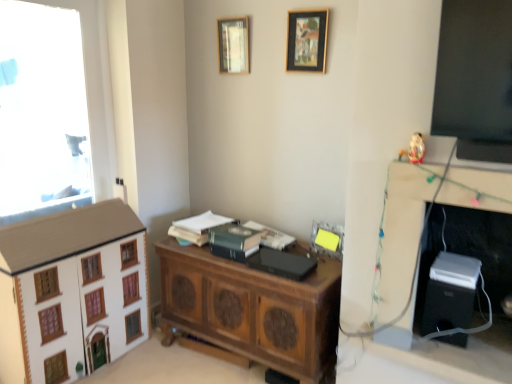
Question: Is wooden chest at center to the right of green matte book at center, which is the 2th book in left-to-right order, from the viewer's perspective?

Choices:
 (A) no
 (B) yes

Answer: (B)

Question: Does wooden chest at center have a larger size compared to green matte book at center, which is the 2th book in left-to-right order?

Choices:
 (A) no
 (B) yes

Answer: (B)

Question: Is wooden chest at center not within green matte book at center, which is counted as the third book, starting from the right?

Choices:
 (A) yes
 (B) no

Answer: (A)

Question: Does wooden chest at center appear on the left side of green matte book at center, which is counted as the third book, starting from the right?

Choices:
 (A) no
 (B) yes

Answer: (A)

Question: Is wooden chest at center positioned with its back to green matte book at center, which is counted as the third book, starting from the right?

Choices:
 (A) no
 (B) yes

Answer: (A)

Question: In terms of size, does white wood dresser at lower left appear bigger or smaller than wooden picture frame at upper center, the 2th picture frame when ordered from right to left?

Choices:
 (A) big
 (B) small

Answer: (A)

Question: From a real-world perspective, relative to wooden picture frame at upper center, placed as the 2th picture frame when sorted from top to bottom, is white wood dresser at lower left vertically above or below?

Choices:
 (A) above
 (B) below

Answer: (B)

Question: Which is correct: white wood dresser at lower left is inside wooden picture frame at upper center, placed as the 2th picture frame when sorted from top to bottom, or outside of it?

Choices:
 (A) inside
 (B) outside

Answer: (B)

Question: From their relative heights in the image, would you say white wood dresser at lower left is taller or shorter than wooden picture frame at upper center, placed as the 2th picture frame when sorted from top to bottom?

Choices:
 (A) tall
 (B) short

Answer: (A)

Question: From a real-world perspective, is black matte book at center, positioned as the fourth book in left-to-right order, physically located above or below porcelain white figurine at upper right?

Choices:
 (A) above
 (B) below

Answer: (B)

Question: Choose the correct answer: Is black matte book at center, positioned as the fourth book in left-to-right order, inside porcelain white figurine at upper right or outside it?

Choices:
 (A) outside
 (B) inside

Answer: (A)

Question: In terms of height, does black matte book at center, acting as the first book starting from the right, look taller or shorter compared to porcelain white figurine at upper right?

Choices:
 (A) short
 (B) tall

Answer: (A)

Question: In terms of size, does black matte book at center, acting as the first book starting from the right, appear bigger or smaller than porcelain white figurine at upper right?

Choices:
 (A) big
 (B) small

Answer: (A)

Question: Would you say wooden picture frame at upper center, acting as the 2th picture frame starting from the bottom, is to the left or to the right of wooden chest at center in the picture?

Choices:
 (A) left
 (B) right

Answer: (B)

Question: Is point (305, 23) closer or farther from the camera than point (313, 377)?

Choices:
 (A) farther
 (B) closer

Answer: (A)